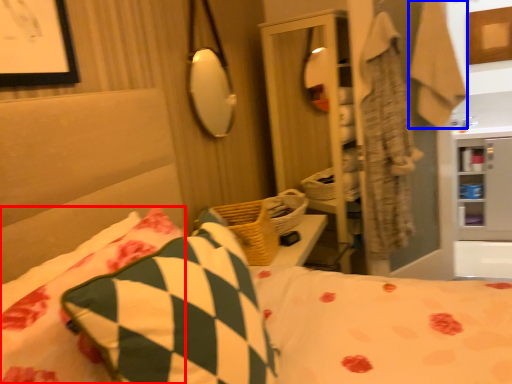
Question: Which object is closer to the camera taking this photo, pillow (highlighted by a red box) or robe (highlighted by a blue box)?

Choices:
 (A) pillow
 (B) robe

Answer: (A)